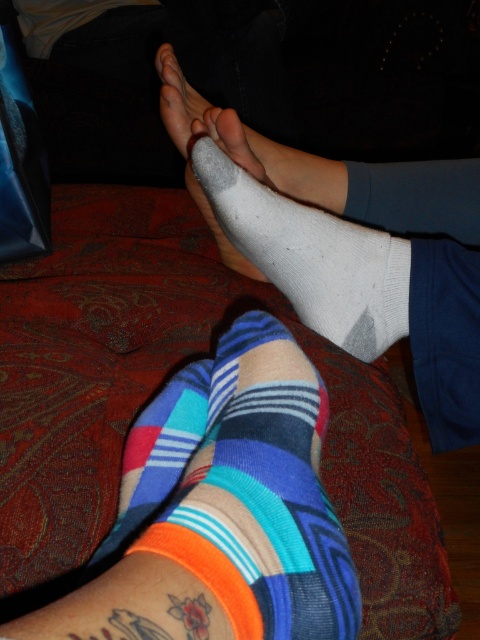
You are a photographer trying to capture a close shot of the multicolored fabric socks at lower center and the white cotton sock at center. Which sock should you focus on first if you want to photograph the larger one?

The multicolored fabric socks at lower center is bigger than the white cotton sock at center, so you should focus on the multicolored fabric socks at lower center first.

You are a photographer taking a picture of two pairs of feet on a couch. You notice the multicolored fabric socks at lower center and the white matte sock at center. Which pair of socks is closer to the camera?

The multicolored fabric socks at lower center is closer to the camera because it is in front of the white matte sock at center.